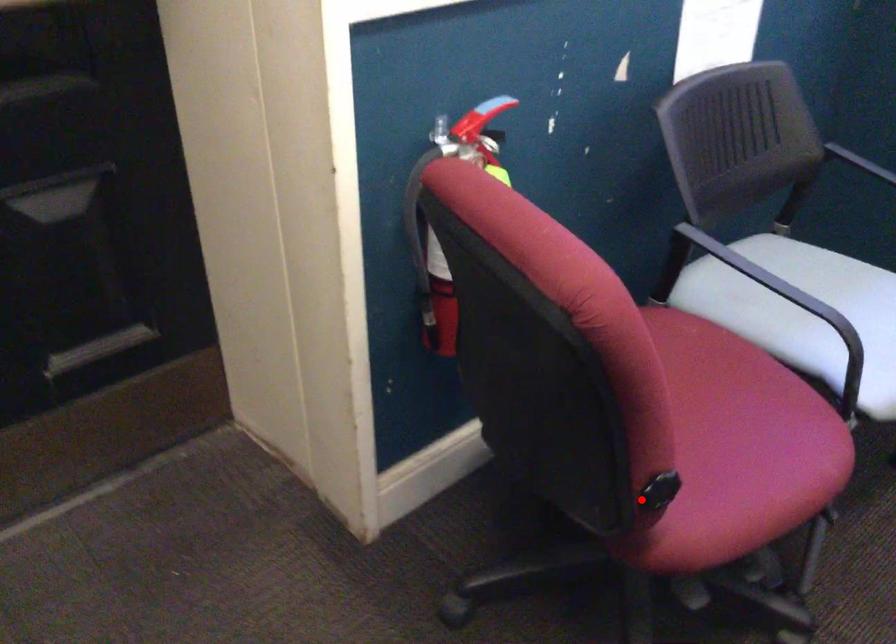
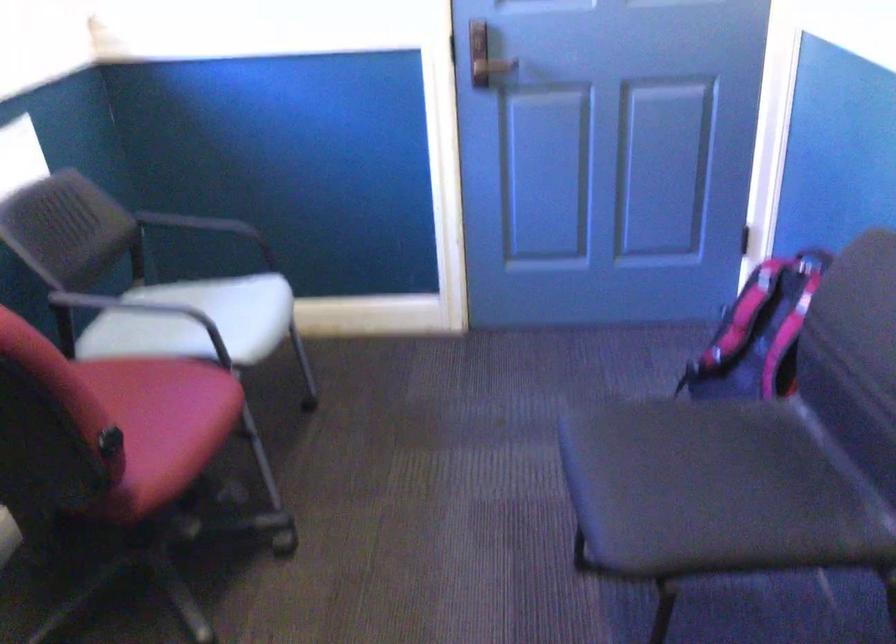
Question: I am providing you with two images of the same scene from different viewpoints. A red point is shown in image1. For the corresponding object point in image2, is it positioned nearer or farther from the camera?

Choices:
 (A) Nearer
 (B) Farther

Answer: (B)